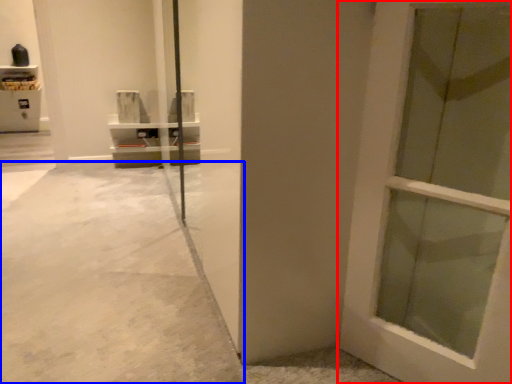
Question: Which object is further to the camera taking this photo, door (highlighted by a red box) or concrete (highlighted by a blue box)?

Choices:
 (A) door
 (B) concrete

Answer: (B)